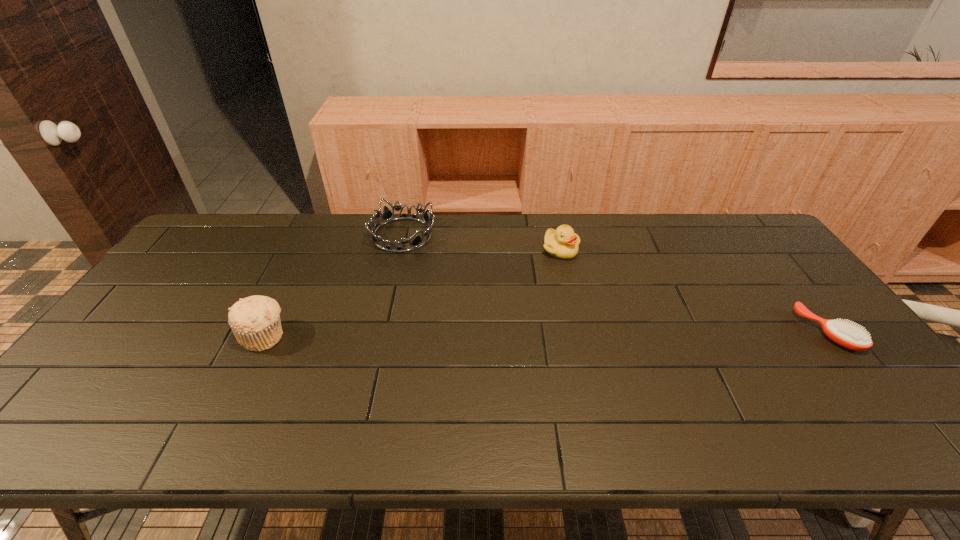
At what (x,y) coordinates should I click in order to perform the action: click on vacant space located 0.050m on the front-facing side of the tiara. Please return your answer as a coordinate pair (x, y). Looking at the image, I should click on (428, 259).

This screenshot has height=540, width=960. What are the coordinates of `free space located 0.140m on the beak of the third object from left to right` in the screenshot? It's located at (571, 291).

This screenshot has height=540, width=960. I want to click on free space located 0.290m on the beak of the third object from left to right, so click(x=582, y=328).

Find the location of a particular element. This screenshot has width=960, height=540. blank area located 0.180m on the beak of the third object from left to right is located at coordinates (574, 300).

Where is `tiara at the far edge`? This screenshot has height=540, width=960. tiara at the far edge is located at coordinates (387, 216).

The image size is (960, 540). Find the location of `duckling at the far edge`. duckling at the far edge is located at coordinates (562, 243).

Find the location of a particular element. Image resolution: width=960 pixels, height=540 pixels. object that is at the right edge is located at coordinates (845, 334).

The image size is (960, 540). Identify the location of vacant space at the far edge of the desktop. (255, 244).

The width and height of the screenshot is (960, 540). I want to click on vacant region at the near edge of the desktop, so click(x=777, y=379).

At what (x,y) coordinates should I click in order to perform the action: click on vacant space at the left edge of the desktop. Please return your answer as a coordinate pair (x, y). The image size is (960, 540). Looking at the image, I should click on (147, 295).